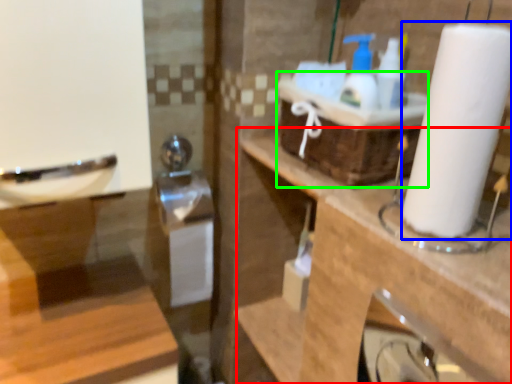
Question: Which is farther away from counter top (highlighted by a red box)? paper towel (highlighted by a blue box) or basket (highlighted by a green box)?

Choices:
 (A) paper towel
 (B) basket

Answer: (A)